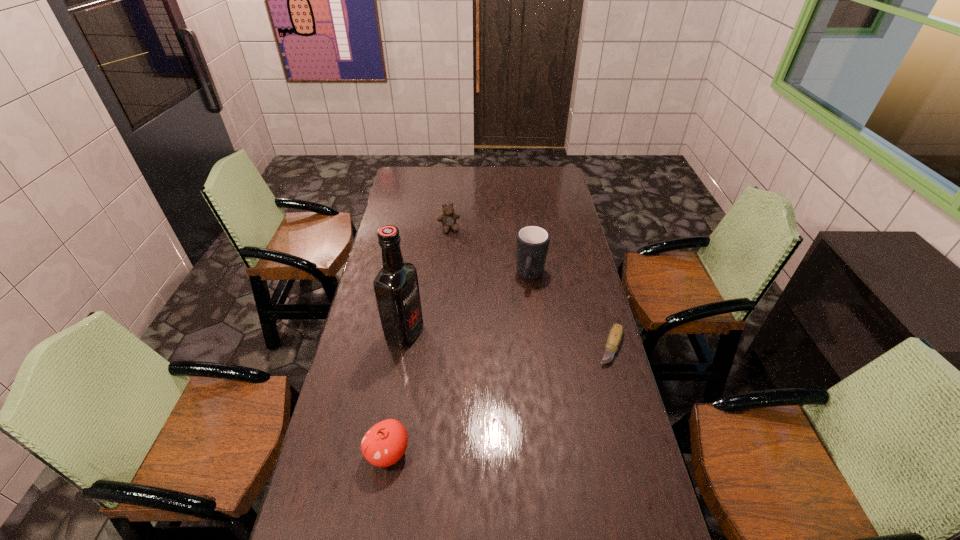
Where is `liquor at the left edge`? liquor at the left edge is located at coordinates click(396, 287).

Find the location of a particular element. The width and height of the screenshot is (960, 540). object located at the right edge is located at coordinates (614, 338).

Locate an element on the screen. The image size is (960, 540). free region at the far edge is located at coordinates tap(523, 183).

The image size is (960, 540). I want to click on free space at the near edge, so point(393,530).

Locate an element on the screen. This screenshot has height=540, width=960. vacant space at the left edge of the desktop is located at coordinates (398, 205).

At what (x,y) coordinates should I click in order to perform the action: click on vacant space at the right edge of the desktop. Please return your answer as a coordinate pair (x, y). The width and height of the screenshot is (960, 540). Looking at the image, I should click on (540, 195).

Where is `blank space at the far left corner`? blank space at the far left corner is located at coordinates (405, 177).

In the image, there is a desktop. What are the coordinates of `free space at the near left corner` in the screenshot? It's located at (301, 517).

Where is `free space that is in between the second tallest object and the pocketknife`? The height and width of the screenshot is (540, 960). free space that is in between the second tallest object and the pocketknife is located at coordinates (571, 312).

Find the location of a particular element. This screenshot has height=540, width=960. free spot between the pocketknife and the fourth shortest object is located at coordinates (571, 312).